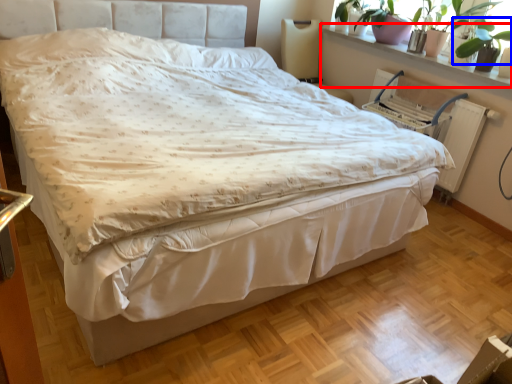
Question: Which object is closer to the camera taking this photo, window sill (highlighted by a red box) or plant (highlighted by a blue box)?

Choices:
 (A) window sill
 (B) plant

Answer: (B)